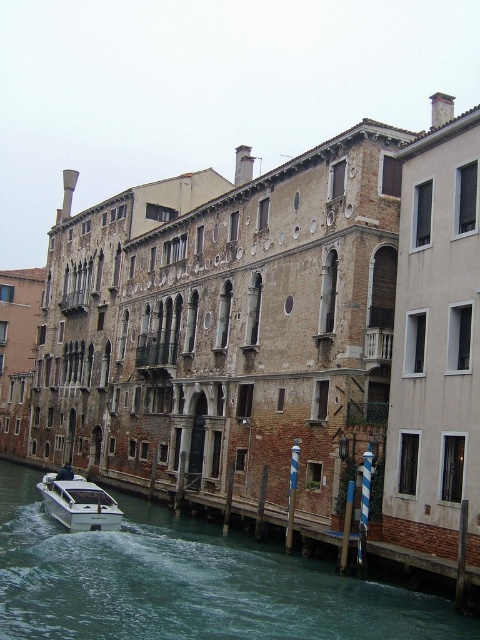
Consider the image. Is clear water at lower left bigger than white glossy boat at lower left?

No.

Image resolution: width=480 pixels, height=640 pixels. What do you see at coordinates (186, 582) in the screenshot? I see `clear water at lower left` at bounding box center [186, 582].

Who is more forward, (326,609) or (116,525)?

Positioned in front is point (326,609).

This screenshot has height=640, width=480. I want to click on clear water at lower left, so click(186, 582).